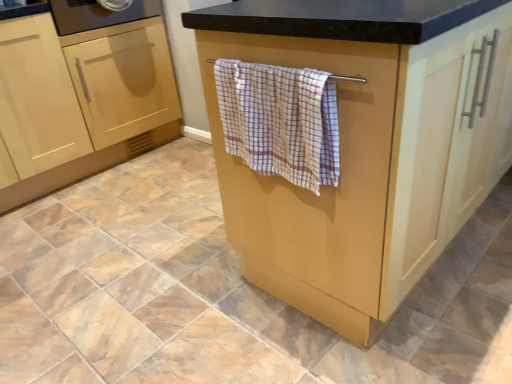
Where is `checkered cotton towel at center`? This screenshot has height=384, width=512. checkered cotton towel at center is located at coordinates (280, 121).

This screenshot has width=512, height=384. What do you see at coordinates (81, 96) in the screenshot? I see `light wood cabinet at left, the 2th cabinetry from the right` at bounding box center [81, 96].

What do you see at coordinates (367, 145) in the screenshot?
I see `matte wood towel rack at center, acting as the first cabinetry starting from the right` at bounding box center [367, 145].

Where is `light wood cabinet at lower left, arranged as the 3th cabinetry when viewed from the right`? The height and width of the screenshot is (384, 512). light wood cabinet at lower left, arranged as the 3th cabinetry when viewed from the right is located at coordinates (37, 98).

Identify the location of checkered cotton towel at center. (280, 121).

Is matte wood towel rack at center, acting as the first cabinetry starting from the right, placed right next to checkered cotton towel at center?

matte wood towel rack at center, acting as the first cabinetry starting from the right, and checkered cotton towel at center are not in contact.

Looking at this image, is matte wood towel rack at center, acting as the first cabinetry starting from the right, aimed at checkered cotton towel at center?

No, matte wood towel rack at center, acting as the first cabinetry starting from the right, is not facing towards checkered cotton towel at center.

Is checkered cotton towel at center located within matte wood towel rack at center, marked as the 3th cabinetry in a left-to-right arrangement?

No, checkered cotton towel at center is not surrounded by matte wood towel rack at center, marked as the 3th cabinetry in a left-to-right arrangement.

Based on the photo, considering the relative sizes of matte wood towel rack at center, acting as the first cabinetry starting from the right, and checkered cotton towel at center in the image provided, is matte wood towel rack at center, acting as the first cabinetry starting from the right, taller than checkered cotton towel at center?

Indeed, matte wood towel rack at center, acting as the first cabinetry starting from the right, has a greater height compared to checkered cotton towel at center.

Who is shorter, light wood cabinet at lower left, arranged as the 3th cabinetry when viewed from the right, or light wood cabinet at left, the 2th cabinetry from the right?

Standing shorter between the two is light wood cabinet at lower left, arranged as the 3th cabinetry when viewed from the right.

Is light wood cabinet at lower left, arranged as the 3th cabinetry when viewed from the right, far from light wood cabinet at left, the 2th cabinetry from the right?

No, light wood cabinet at lower left, arranged as the 3th cabinetry when viewed from the right, is in close proximity to light wood cabinet at left, the 2th cabinetry from the right.

Does light wood cabinet at lower left, the first cabinetry in the left-to-right sequence, have a greater width compared to light wood cabinet at left, the second cabinetry viewed from the left?

Yes, light wood cabinet at lower left, the first cabinetry in the left-to-right sequence, is wider than light wood cabinet at left, the second cabinetry viewed from the left.

Could you tell me if light wood cabinet at lower left, the first cabinetry in the left-to-right sequence, is facing light wood cabinet at left, the second cabinetry viewed from the left?

No.

Which is farther from the camera, (227, 62) or (392, 284)?

Point (392, 284)

Between checkered cotton towel at center and matte wood towel rack at center, acting as the first cabinetry starting from the right, which one has larger width?

matte wood towel rack at center, acting as the first cabinetry starting from the right.

Can you tell me how much checkered cotton towel at center and matte wood towel rack at center, marked as the 3th cabinetry in a left-to-right arrangement, differ in facing direction?

8.19e-05 degrees.

The width and height of the screenshot is (512, 384). What are the coordinates of `bath towel on the left of matte wood towel rack at center, acting as the first cabinetry starting from the right` in the screenshot? It's located at (280, 121).

Which is more to the right, light wood cabinet at left, the 2th cabinetry from the right, or light wood cabinet at lower left, arranged as the 3th cabinetry when viewed from the right?

light wood cabinet at left, the 2th cabinetry from the right, is more to the right.

From a real-world perspective, between light wood cabinet at left, the second cabinetry viewed from the left, and light wood cabinet at lower left, arranged as the 3th cabinetry when viewed from the right, who is vertically lower?

light wood cabinet at lower left, arranged as the 3th cabinetry when viewed from the right, is physically lower.

Is light wood cabinet at left, the 2th cabinetry from the right, smaller than light wood cabinet at lower left, arranged as the 3th cabinetry when viewed from the right?

No, light wood cabinet at left, the 2th cabinetry from the right, is not smaller than light wood cabinet at lower left, arranged as the 3th cabinetry when viewed from the right.

Consider the image. Considering the sizes of objects light wood cabinet at lower left, the first cabinetry in the left-to-right sequence, and matte wood towel rack at center, marked as the 3th cabinetry in a left-to-right arrangement, in the image provided, who is thinner, light wood cabinet at lower left, the first cabinetry in the left-to-right sequence, or matte wood towel rack at center, marked as the 3th cabinetry in a left-to-right arrangement,?

→ With smaller width is light wood cabinet at lower left, the first cabinetry in the left-to-right sequence.

How many degrees apart are the facing directions of light wood cabinet at lower left, arranged as the 3th cabinetry when viewed from the right, and matte wood towel rack at center, marked as the 3th cabinetry in a left-to-right arrangement?

1.17 degrees separate the facing orientations of light wood cabinet at lower left, arranged as the 3th cabinetry when viewed from the right, and matte wood towel rack at center, marked as the 3th cabinetry in a left-to-right arrangement.

Which object is positioned more to the left, light wood cabinet at lower left, the first cabinetry in the left-to-right sequence, or matte wood towel rack at center, acting as the first cabinetry starting from the right?

Positioned to the left is light wood cabinet at lower left, the first cabinetry in the left-to-right sequence.

From a real-world perspective, is checkered cotton towel at center beneath light wood cabinet at left, the 2th cabinetry from the right?

Incorrect, from a real-world perspective, checkered cotton towel at center is higher than light wood cabinet at left, the 2th cabinetry from the right.

Is point (233, 131) in front of point (19, 71)?

Yes, it is in front of point (19, 71).

Is the surface of checkered cotton towel at center in direct contact with light wood cabinet at left, the second cabinetry viewed from the left?

checkered cotton towel at center and light wood cabinet at left, the second cabinetry viewed from the left, are clearly separated.

Can you confirm if checkered cotton towel at center is thinner than light wood cabinet at left, the 2th cabinetry from the right?

Yes.

In the scene shown: Which is less distant, (x=232, y=27) or (x=174, y=136)?

The point (x=232, y=27) is closer.

In terms of width, does matte wood towel rack at center, acting as the first cabinetry starting from the right, look wider or thinner when compared to light wood cabinet at left, the second cabinetry viewed from the left?

Clearly, matte wood towel rack at center, acting as the first cabinetry starting from the right, has more width compared to light wood cabinet at left, the second cabinetry viewed from the left.

From the image's perspective, is matte wood towel rack at center, acting as the first cabinetry starting from the right, positioned above or below light wood cabinet at left, the second cabinetry viewed from the left?

matte wood towel rack at center, acting as the first cabinetry starting from the right, is below light wood cabinet at left, the second cabinetry viewed from the left.

Can you confirm if matte wood towel rack at center, marked as the 3th cabinetry in a left-to-right arrangement, is taller than light wood cabinet at left, the 2th cabinetry from the right?

No.

Find the location of `cabinetry that is the 1st one below the checkered cotton towel at center (from a real-world perspective)`. cabinetry that is the 1st one below the checkered cotton towel at center (from a real-world perspective) is located at coordinates (367, 145).

From the light wood cabinet at lower left, the first cabinetry in the left-to-right sequence, count 1st cabinetry to the right and point to it. Please provide its 2D coordinates.

[(81, 96)]

When comparing their distances from checkered cotton towel at center, does light wood cabinet at left, the second cabinetry viewed from the left, or light wood cabinet at lower left, the first cabinetry in the left-to-right sequence, seem closer?

light wood cabinet at lower left, the first cabinetry in the left-to-right sequence, lies closer to checkered cotton towel at center than the other object.

Based on their spatial positions, is light wood cabinet at left, the 2th cabinetry from the right, or matte wood towel rack at center, acting as the first cabinetry starting from the right, closer to light wood cabinet at lower left, the first cabinetry in the left-to-right sequence?

light wood cabinet at left, the 2th cabinetry from the right.

Based on their spatial positions, is checkered cotton towel at center or light wood cabinet at left, the second cabinetry viewed from the left, closer to matte wood towel rack at center, acting as the first cabinetry starting from the right?

checkered cotton towel at center lies closer to matte wood towel rack at center, acting as the first cabinetry starting from the right, than the other object.

When comparing their distances from light wood cabinet at lower left, arranged as the 3th cabinetry when viewed from the right, does checkered cotton towel at center or matte wood towel rack at center, acting as the first cabinetry starting from the right, seem further?

matte wood towel rack at center, acting as the first cabinetry starting from the right, lies further to light wood cabinet at lower left, arranged as the 3th cabinetry when viewed from the right, than the other object.

Estimate the real-world distances between objects in this image. Which object is closer to matte wood towel rack at center, acting as the first cabinetry starting from the right, light wood cabinet at left, the 2th cabinetry from the right, or light wood cabinet at lower left, the first cabinetry in the left-to-right sequence?

The object closer to matte wood towel rack at center, acting as the first cabinetry starting from the right, is light wood cabinet at left, the 2th cabinetry from the right.

Estimate the real-world distances between objects in this image. Which object is further from matte wood towel rack at center, acting as the first cabinetry starting from the right, light wood cabinet at lower left, arranged as the 3th cabinetry when viewed from the right, or light wood cabinet at left, the second cabinetry viewed from the left?

The object further to matte wood towel rack at center, acting as the first cabinetry starting from the right, is light wood cabinet at lower left, arranged as the 3th cabinetry when viewed from the right.

Based on their spatial positions, is matte wood towel rack at center, marked as the 3th cabinetry in a left-to-right arrangement, or light wood cabinet at left, the second cabinetry viewed from the left, closer to checkered cotton towel at center?

matte wood towel rack at center, marked as the 3th cabinetry in a left-to-right arrangement.

Considering their positions, is checkered cotton towel at center positioned closer to light wood cabinet at left, the second cabinetry viewed from the left, than matte wood towel rack at center, marked as the 3th cabinetry in a left-to-right arrangement?

checkered cotton towel at center is positioned closer to the anchor light wood cabinet at left, the second cabinetry viewed from the left.

The height and width of the screenshot is (384, 512). In order to click on cabinetry between light wood cabinet at lower left, arranged as the 3th cabinetry when viewed from the right, and checkered cotton towel at center, in the horizontal direction in this screenshot , I will do `click(81, 96)`.

I want to click on cabinetry situated between light wood cabinet at lower left, arranged as the 3th cabinetry when viewed from the right, and matte wood towel rack at center, acting as the first cabinetry starting from the right, from left to right, so click(x=81, y=96).

You are a GUI agent. You are given a task and a screenshot of the screen. Output one action in this format:
    pyautogui.click(x=<x>, y=<y>)
    Task: Click on the bath towel located between light wood cabinet at left, the second cabinetry viewed from the left, and matte wood towel rack at center, marked as the 3th cabinetry in a left-to-right arrangement, in the left-right direction
    
    Given the screenshot: What is the action you would take?
    pyautogui.click(x=280, y=121)

What are the coordinates of `bath towel situated between light wood cabinet at lower left, arranged as the 3th cabinetry when viewed from the right, and matte wood towel rack at center, marked as the 3th cabinetry in a left-to-right arrangement, from left to right` in the screenshot? It's located at (280, 121).